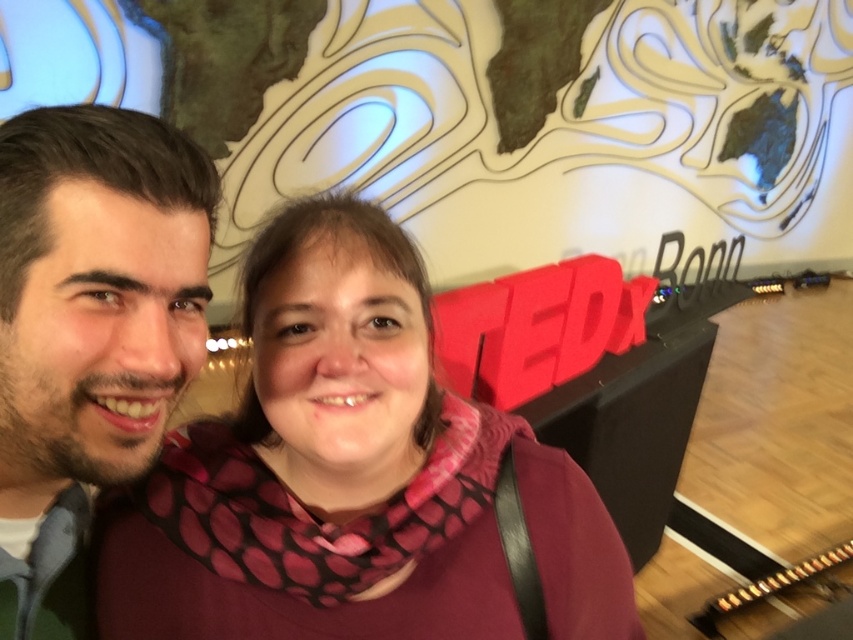
Question: Among these objects, which one is nearest to the camera?

Choices:
 (A) dark brown hair at left
 (B) pink dotted scarf at center

Answer: (A)

Question: Is pink dotted scarf at center positioned before dark brown hair at left?

Choices:
 (A) no
 (B) yes

Answer: (A)

Question: From the image, what is the correct spatial relationship of pink dotted scarf at center in relation to dark brown hair at left?

Choices:
 (A) left
 (B) right

Answer: (B)

Question: Which of the following is the farthest from the observer?

Choices:
 (A) dark brown hair at left
 (B) pink dotted scarf at center

Answer: (B)

Question: Which point is farther to the camera?

Choices:
 (A) dark brown hair at left
 (B) pink dotted scarf at center

Answer: (B)

Question: Can you confirm if pink dotted scarf at center is positioned to the right of dark brown hair at left?

Choices:
 (A) yes
 (B) no

Answer: (A)